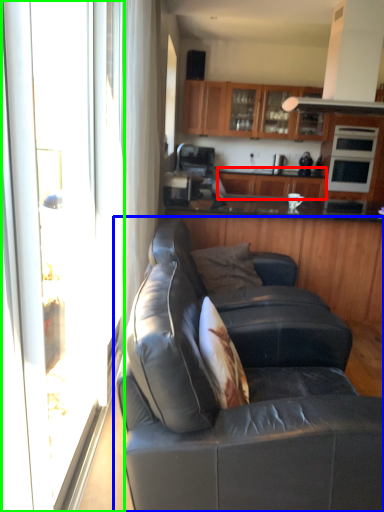
Question: Which is farther away from cabinetry (highlighted by a red box)? studio couch (highlighted by a blue box) or screen door (highlighted by a green box)?

Choices:
 (A) studio couch
 (B) screen door

Answer: (B)